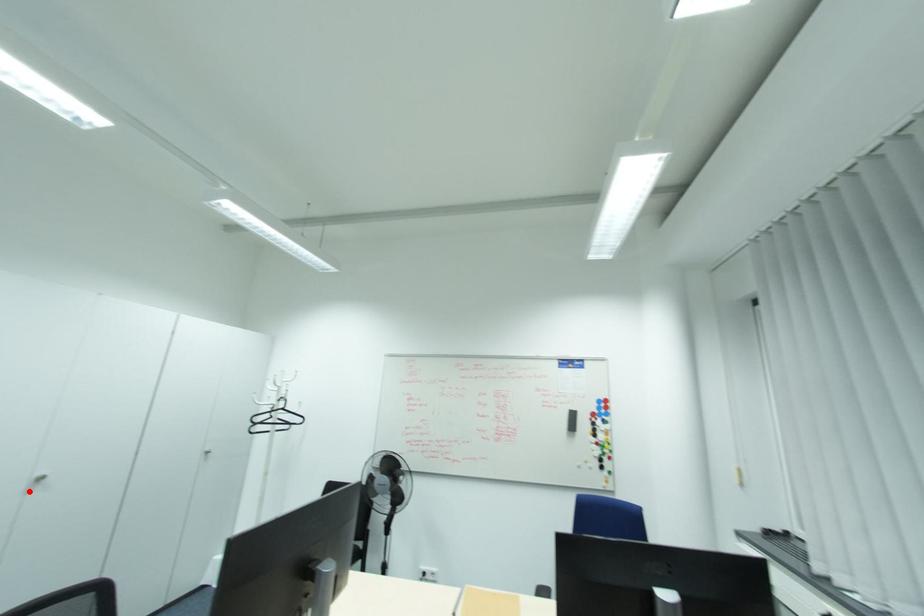
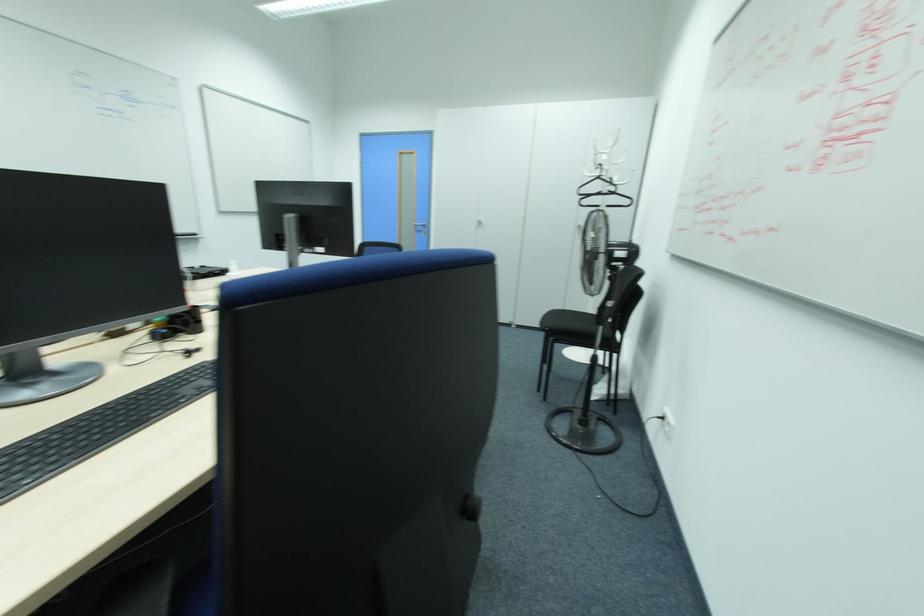
Question: I am providing you with two images of the same scene from different viewpoints. A red point is shown in image1. For the corresponding object point in image2, is it positioned nearer or farther from the camera?

Choices:
 (A) Nearer
 (B) Farther

Answer: (B)